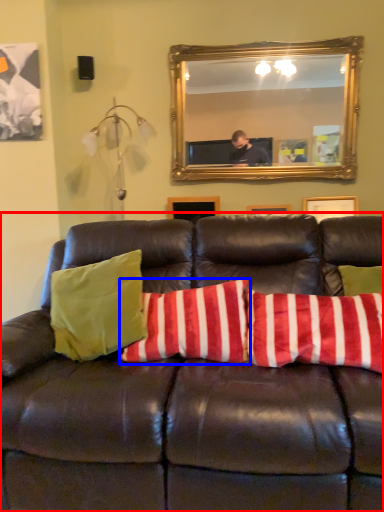
Question: Which of the following is the farthest to the observer, studio couch (highlighted by a red box) or pillow (highlighted by a blue box)?

Choices:
 (A) studio couch
 (B) pillow

Answer: (B)